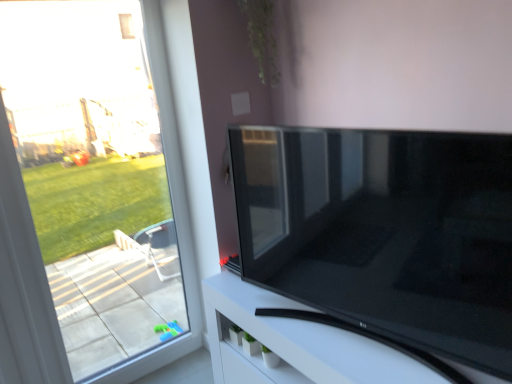
Question: Could you tell me if black glossy tv stand at lower right is turned towards transparent glass window at left?

Choices:
 (A) yes
 (B) no

Answer: (B)

Question: Is black glossy tv stand at lower right thinner than transparent glass window at left?

Choices:
 (A) yes
 (B) no

Answer: (B)

Question: From the image's perspective, is black glossy tv stand at lower right located above transparent glass window at left?

Choices:
 (A) yes
 (B) no

Answer: (B)

Question: Does black glossy tv stand at lower right have a smaller size compared to transparent glass window at left?

Choices:
 (A) yes
 (B) no

Answer: (B)

Question: From a real-world perspective, is black glossy tv stand at lower right positioned over transparent glass window at left based on gravity?

Choices:
 (A) yes
 (B) no

Answer: (B)

Question: Is transparent glass window at left taller or shorter than black glossy tv stand at lower right?

Choices:
 (A) short
 (B) tall

Answer: (B)

Question: Is transparent glass window at left wider or thinner than black glossy tv stand at lower right?

Choices:
 (A) wide
 (B) thin

Answer: (B)

Question: Based on their positions, is transparent glass window at left located to the left or right of black glossy tv stand at lower right?

Choices:
 (A) left
 (B) right

Answer: (A)

Question: Would you say transparent glass window at left is inside or outside black glossy tv stand at lower right?

Choices:
 (A) outside
 (B) inside

Answer: (A)

Question: From a real-world perspective, is black glossy tv stand at lower right positioned above or below matte black tv at center?

Choices:
 (A) above
 (B) below

Answer: (B)

Question: From their relative heights in the image, would you say black glossy tv stand at lower right is taller or shorter than matte black tv at center?

Choices:
 (A) tall
 (B) short

Answer: (B)

Question: Looking at their shapes, would you say black glossy tv stand at lower right is wider or thinner than matte black tv at center?

Choices:
 (A) wide
 (B) thin

Answer: (A)

Question: Does point pyautogui.click(x=439, y=370) appear closer or farther from the camera than point pyautogui.click(x=503, y=185)?

Choices:
 (A) closer
 (B) farther

Answer: (B)

Question: Do you think green matte plant at upper center is within transparent glass window at left, or outside of it?

Choices:
 (A) outside
 (B) inside

Answer: (A)

Question: Considering their positions, is green matte plant at upper center located in front of or behind transparent glass window at left?

Choices:
 (A) front
 (B) behind

Answer: (B)